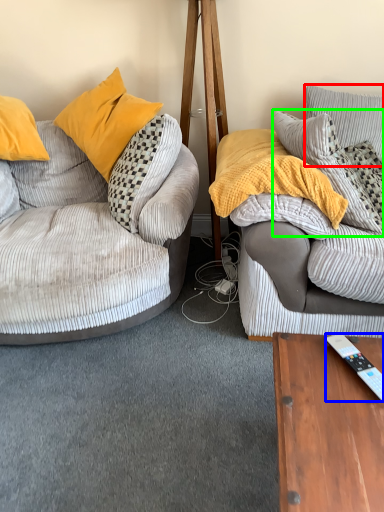
Question: Which object is positioned farthest from pillow (highlighted by a red box)? Select from remote control (highlighted by a blue box) and pillow (highlighted by a green box).

Choices:
 (A) remote control
 (B) pillow

Answer: (A)